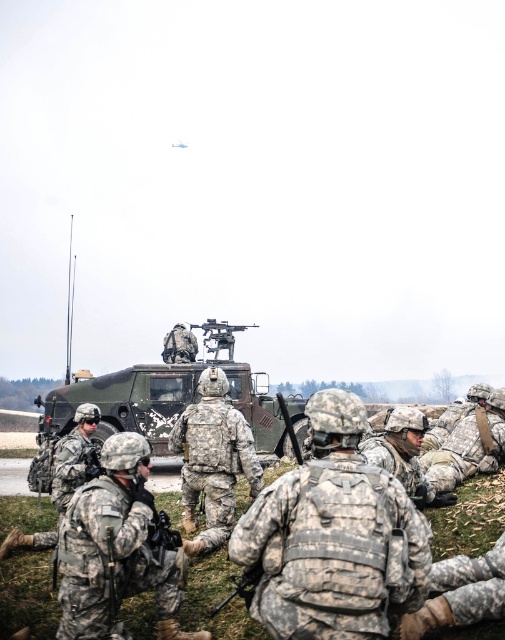
Which of these two, camouflage uniform at center or camouflage fabric uniform at lower right, stands taller?

camouflage uniform at center is taller.

Who is more forward, (227, 506) or (459, 451)?

Point (227, 506)

Between point (227, 465) and point (472, 416), which one is positioned behind?

The point (472, 416) is behind.

At what (x,y) coordinates should I click in order to perform the action: click on camouflage uniform at center. Please return your answer as a coordinate pair (x, y). Looking at the image, I should click on (213, 460).

Who is positioned more to the right, camouflage fabric uniform at center or camouflage fabric tank at center?

From the viewer's perspective, camouflage fabric uniform at center appears more on the right side.

Does camouflage fabric uniform at center appear on the left side of camouflage fabric tank at center?

Incorrect, camouflage fabric uniform at center is not on the left side of camouflage fabric tank at center.

Is point (112, 483) closer to camera compared to point (125, 371)?

Yes, point (112, 483) is closer to viewer.

Locate an element on the screen. camouflage fabric uniform at center is located at coordinates (117, 548).

Is camouflage fabric backpack at center thinner than camouflage fabric tank at center?

Yes.

Is point (390, 582) less distant than point (180, 352)?

Yes, point (390, 582) is closer to viewer.

The width and height of the screenshot is (505, 640). Find the location of `camouflage fabric backpack at center`. camouflage fabric backpack at center is located at coordinates (332, 536).